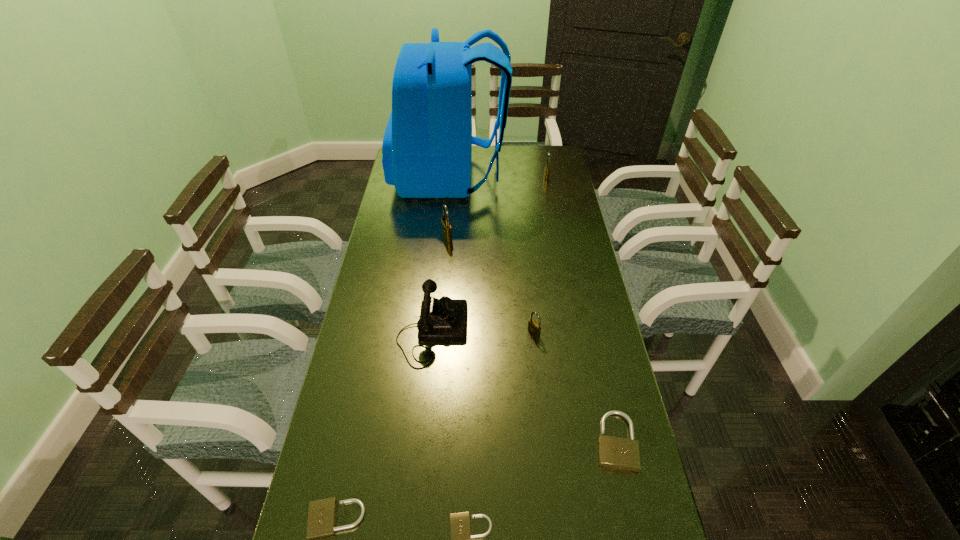
Find the location of a particular element. This screenshot has width=960, height=540. the tallest object is located at coordinates (427, 146).

The image size is (960, 540). I want to click on backpack, so click(427, 146).

This screenshot has width=960, height=540. I want to click on the tallest padlock, so click(446, 226).

This screenshot has width=960, height=540. Identify the location of the fifth padlock from right to left. (446, 226).

This screenshot has height=540, width=960. Find the location of `the farthest brass padlock`. the farthest brass padlock is located at coordinates (547, 166).

At what (x,y) coordinates should I click in order to perform the action: click on the second biggest brass padlock. Please return your answer as a coordinate pair (x, y). The image size is (960, 540). Looking at the image, I should click on (547, 166).

Where is `telephone`? telephone is located at coordinates (445, 319).

Where is `the smallest brass padlock`? The image size is (960, 540). the smallest brass padlock is located at coordinates (534, 328).

The width and height of the screenshot is (960, 540). I want to click on the fourth nearest padlock, so click(x=534, y=328).

This screenshot has height=540, width=960. I want to click on the farthest beige padlock, so click(x=619, y=453).